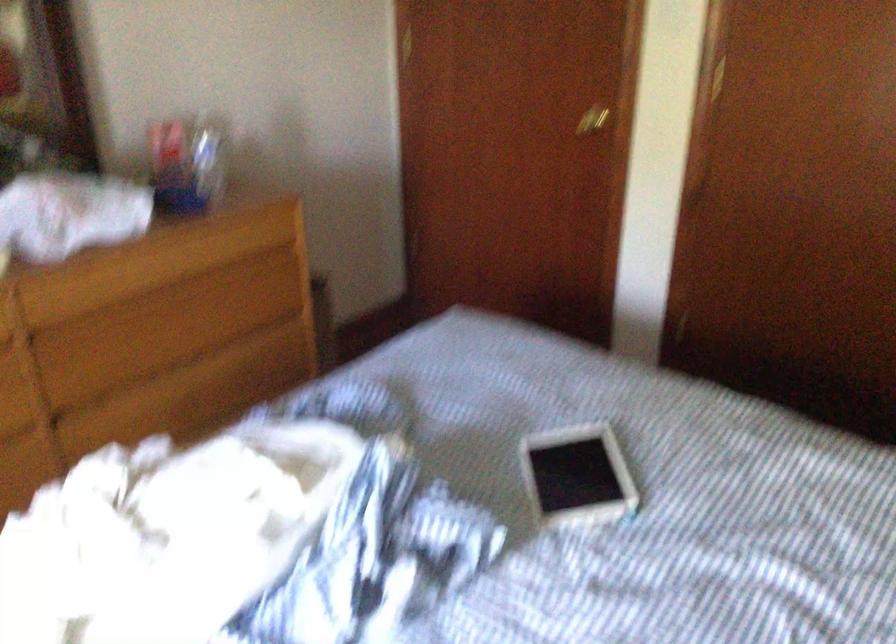
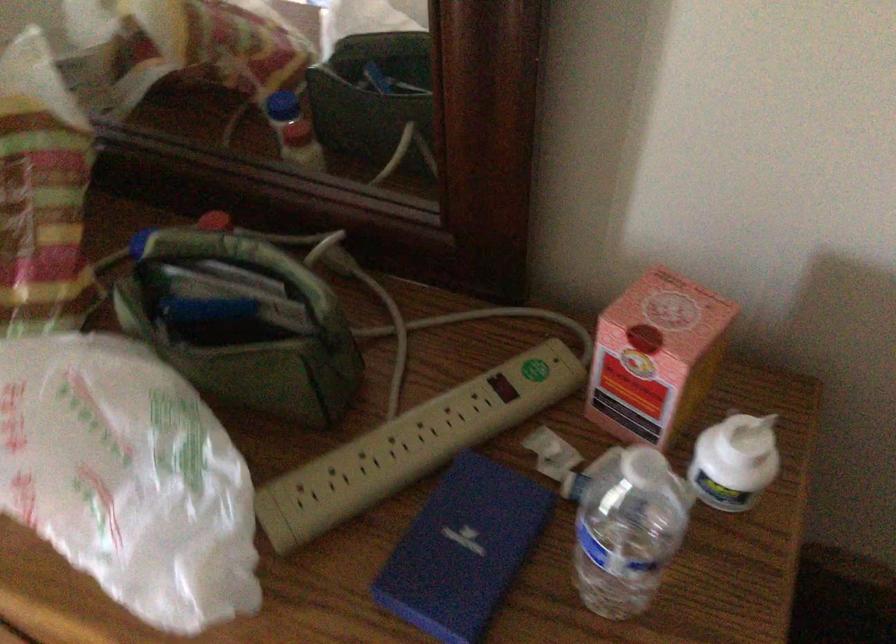
Find the pixel in the second image that matches [179,193] in the first image.

(462, 550)